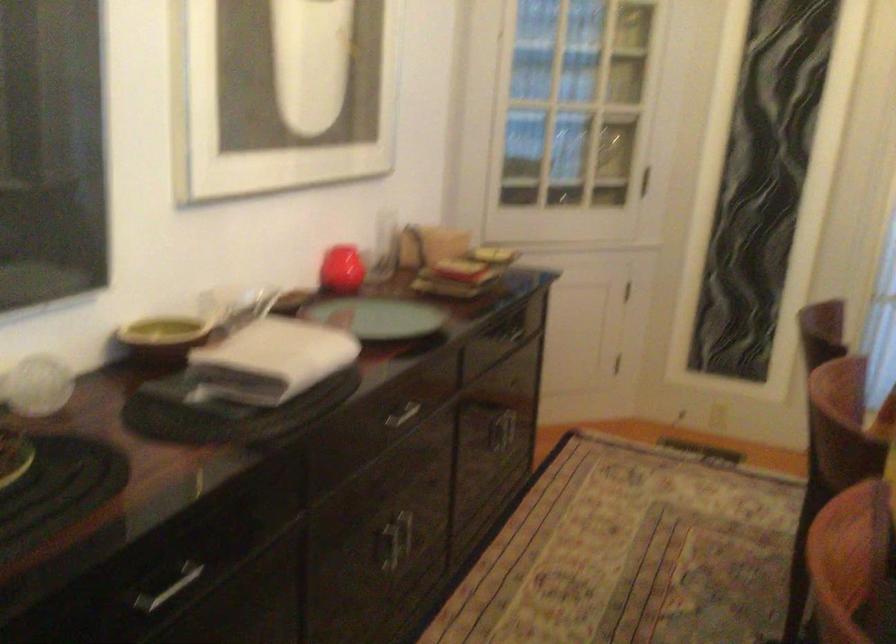
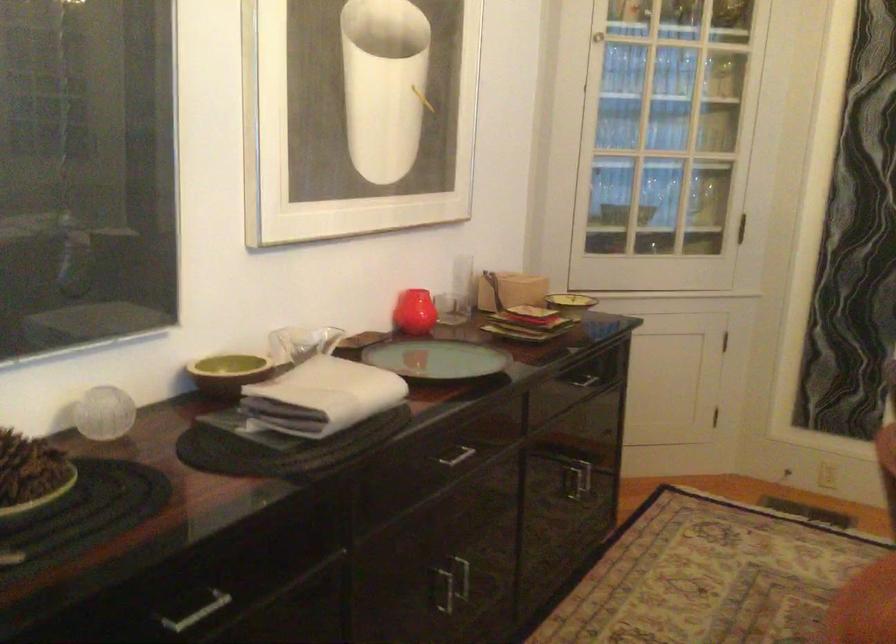
In the second image, find the point that corresponds to (x=235, y=303) in the first image.

(300, 343)